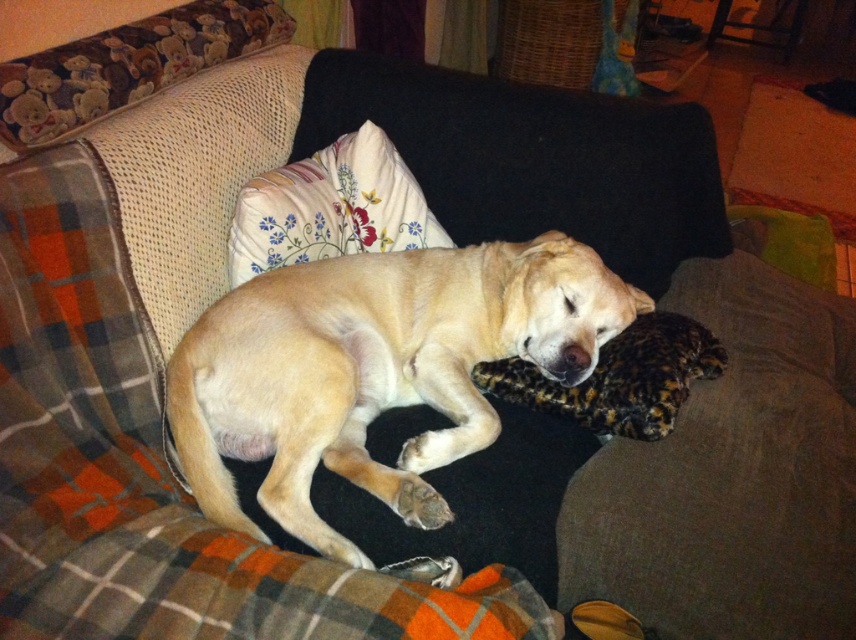
Can you confirm if floral fabric pillow at upper center is smaller than brown fuzzy pillow at center?

No.

Is floral fabric pillow at upper center taller than brown fuzzy pillow at center?

Correct, floral fabric pillow at upper center is much taller as brown fuzzy pillow at center.

This screenshot has width=856, height=640. Describe the element at coordinates (330, 208) in the screenshot. I see `floral fabric pillow at upper center` at that location.

In order to click on floral fabric pillow at upper center in this screenshot , I will do `click(330, 208)`.

Can you confirm if golden fur dog at center is shorter than brown fuzzy pillow at center?

In fact, golden fur dog at center may be taller than brown fuzzy pillow at center.

Can you confirm if golden fur dog at center is positioned to the left of brown fuzzy pillow at center?

Correct, you'll find golden fur dog at center to the left of brown fuzzy pillow at center.

Locate an element on the screen. The width and height of the screenshot is (856, 640). golden fur dog at center is located at coordinates (376, 369).

Between point (272, 346) and point (265, 214), which one is positioned in front?

Positioned in front is point (272, 346).

Does golden fur dog at center have a smaller size compared to floral fabric pillow at upper center?

No.

Is point (177, 378) farther from viewer compared to point (229, 234)?

That is False.

You are a GUI agent. You are given a task and a screenshot of the screen. Output one action in this format:
    pyautogui.click(x=<x>, y=<y>)
    Task: Click on the golden fur dog at center
    This screenshot has height=640, width=856.
    Given the screenshot: What is the action you would take?
    pyautogui.click(x=376, y=369)